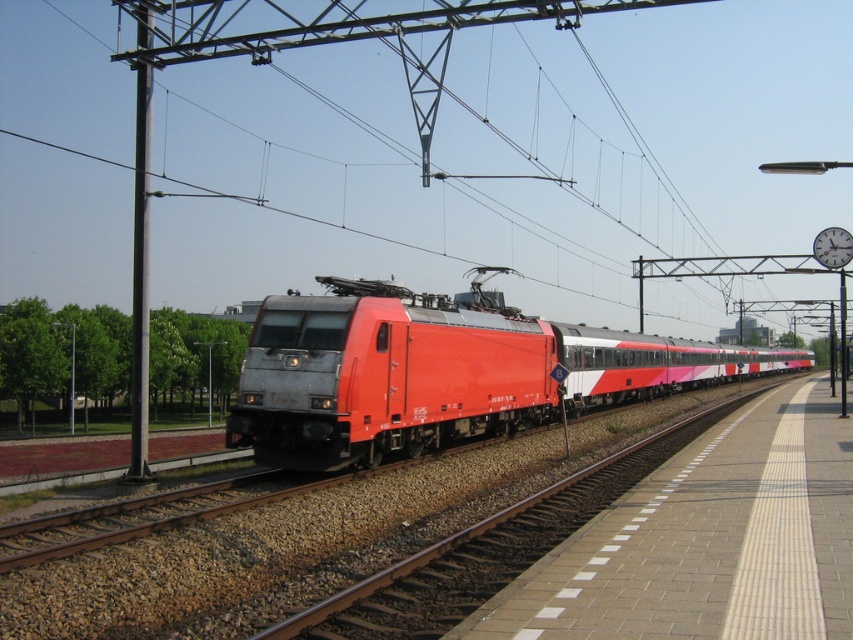
You are a railway engineer assessing the space between the metallic red train at center and the brick platform at center. Based on their widths, which one is wider?

The metallic red train at center is wider than the brick platform at center.

You are standing at the point labeled point (514, 600) in the railway station scene. The train is moving towards the right. If you want to board the train, which direction should you move relative to the point labeled point (305, 420)?

Since point (305, 420) is behind point (514, 600), you should move towards the direction of point (305, 420) to board the train as the train is moving towards the right.

You are a passenger waiting on the brick platform at center. You see the metallic red train at center approaching. Which direction should you look to see the front of the train?

The metallic red train at center is positioned over the brick platform at center, so the front of the train is facing towards the right since the train is moving towards the right as described in the scene. Therefore, you should look to your right to see the front of the metallic red train at center.